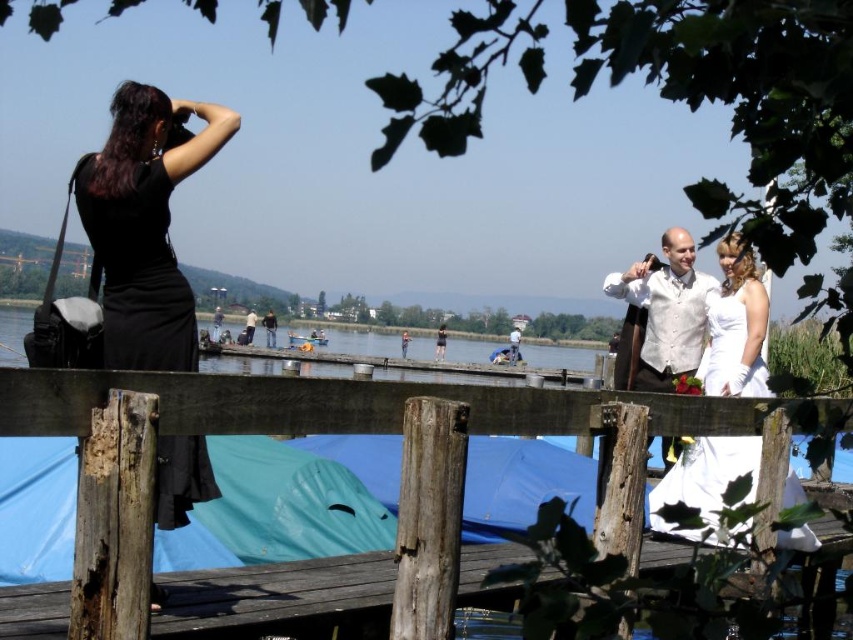
Does wooden at lower center have a greater height compared to white satin vest at center?

No.

Which is in front, point (526, 417) or point (634, 355)?

Positioned in front is point (526, 417).

I want to click on wooden at lower center, so click(345, 404).

Which is above, black satin dress at left or white satin vest at center?

black satin dress at left is higher up.

Does point (152, 227) come behind point (685, 243)?

No, (152, 227) is in front of (685, 243).

This screenshot has width=853, height=640. Identify the location of black satin dress at left. (137, 273).

Is point (659, 387) more distant than point (421, 349)?

No, (659, 387) is in front of (421, 349).

Between white satin vest at center and clear blue water at center, which one appears on the left side from the viewer's perspective?

clear blue water at center is more to the left.

The image size is (853, 640). What do you see at coordinates (660, 316) in the screenshot?
I see `white satin vest at center` at bounding box center [660, 316].

I want to click on white satin vest at center, so click(x=660, y=316).